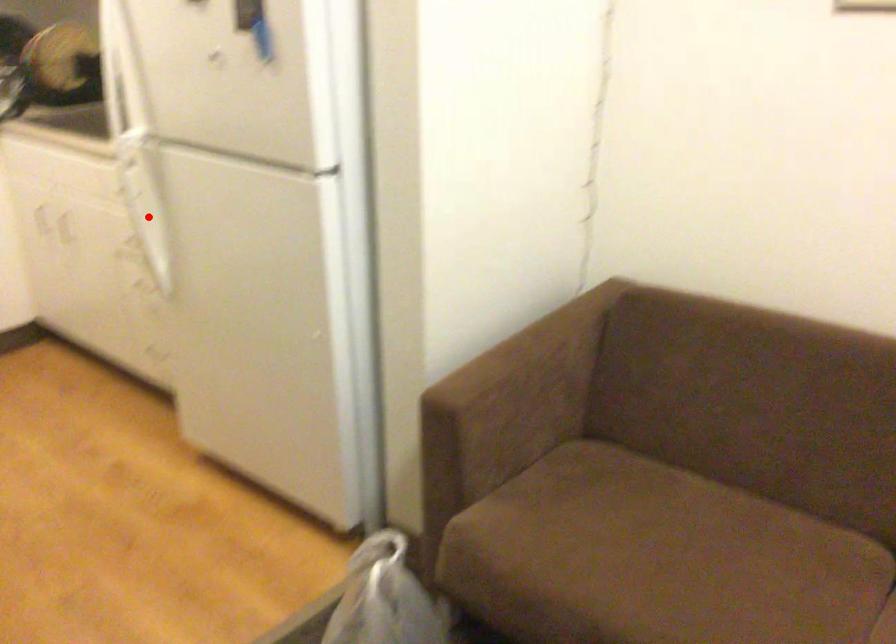
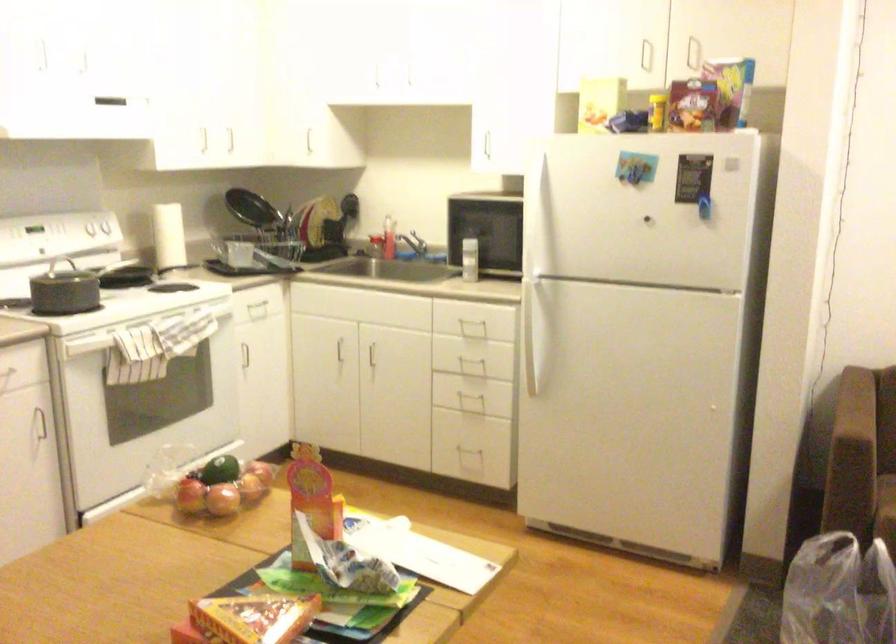
Question: I am providing you with two images of the same scene from different viewpoints. In image1, a red point is highlighted. Considering the same 3D point in image2, which of the following is correct?

Choices:
 (A) It is closer
 (B) It is farther

Answer: (B)